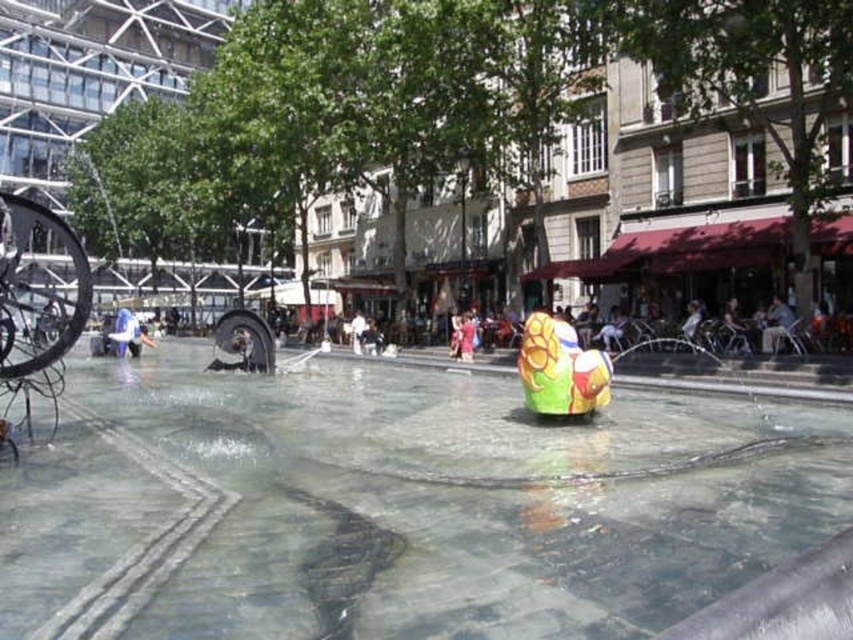
Question: Among these objects, which one is farthest from the camera?

Choices:
 (A) clear glass water at center
 (B) matte pink dress at center

Answer: (B)

Question: Does clear glass water at center appear over matte pink dress at center?

Choices:
 (A) no
 (B) yes

Answer: (A)

Question: Can you confirm if clear glass water at center is thinner than matte pink dress at center?

Choices:
 (A) no
 (B) yes

Answer: (A)

Question: Among these objects, which one is farthest from the camera?

Choices:
 (A) matte pink dress at center
 (B) glossy plastic toy at center
 (C) clear glass water at center

Answer: (A)

Question: Which object is the closest to the matte pink dress at center?

Choices:
 (A) clear glass water at center
 (B) glossy plastic toy at center

Answer: (B)

Question: Is clear glass water at center bigger than matte pink dress at center?

Choices:
 (A) no
 (B) yes

Answer: (B)